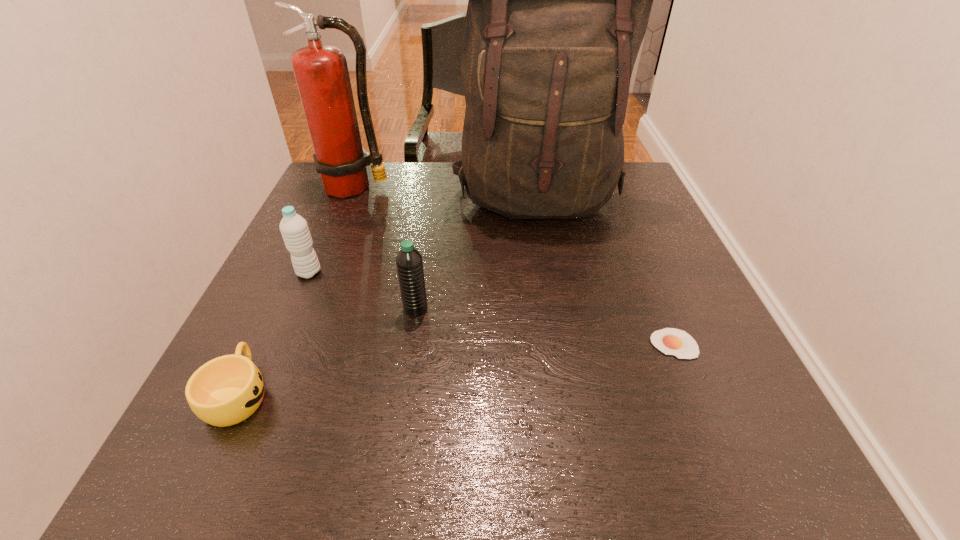
Identify the location of the tallest object. point(559,0).

This screenshot has height=540, width=960. Find the location of `the second tallest object`. the second tallest object is located at coordinates (321, 72).

Where is `the left water bottle`? the left water bottle is located at coordinates (294, 229).

Locate an element on the screen. This screenshot has width=960, height=540. the farther water bottle is located at coordinates (294, 229).

Locate an element on the screen. the third nearest object is located at coordinates (409, 263).

You are a GUI agent. You are given a task and a screenshot of the screen. Output one action in this format:
    pyautogui.click(x=<x>, y=<y>)
    Task: Click on the fourth object from left to right
    
    Given the screenshot: What is the action you would take?
    pyautogui.click(x=409, y=263)

Image resolution: width=960 pixels, height=540 pixels. I want to click on the fifth tallest object, so click(226, 390).

This screenshot has width=960, height=540. Identify the location of cup. (226, 390).

The width and height of the screenshot is (960, 540). I want to click on egg yolk, so click(x=670, y=341).

I want to click on the second nearest object, so coord(670,341).